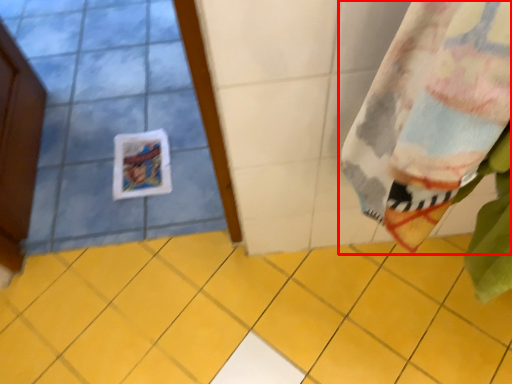
Question: From the image's perspective, what is the correct spatial relationship of curtain (annotated by the red box) in relation to ceramic tile?

Choices:
 (A) below
 (B) above

Answer: (B)